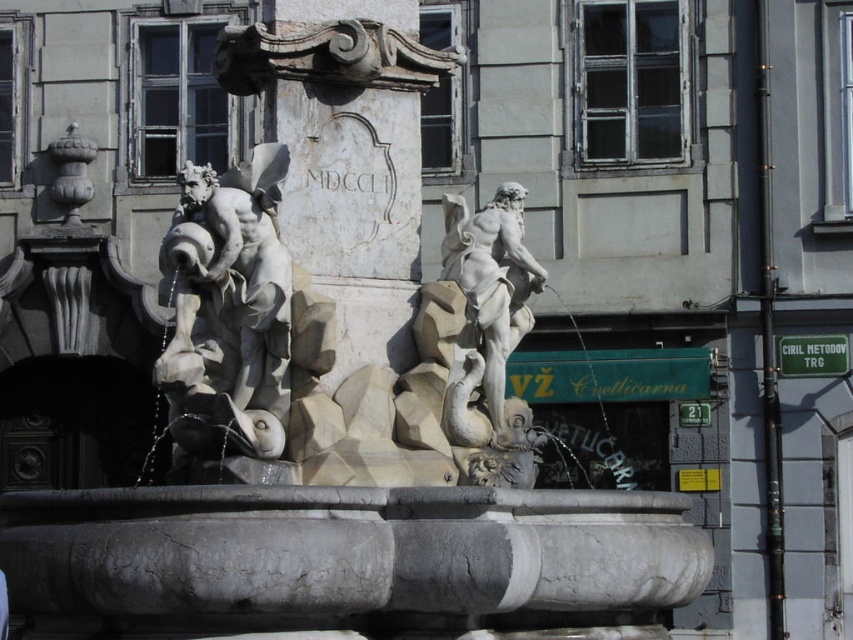
You are an art student visiting the fountain and want to sketch the statues. You notice two statues, the white marble statue at left and the white marble statue at center. Which one should you focus on first if you want to draw the taller one?

The white marble statue at left is much taller than the white marble statue at center, so you should focus on the white marble statue at left first.

You are a tour guide leading a group to the center statue. You are currently at the left statue. The path between them is straight. Your group has a child who uses a wheelchair. Is the path between the white marble statue at left and the white marble statue at center wide enough for the wheelchair to pass through comfortably?

The distance between the white marble statue at left and the white marble statue at center is 4.20 meters. A standard wheelchair requires a minimum of 0.9 meters of width to pass through comfortably. Since 4.20 meters is significantly wider than 0.9 meters, the path is more than wide enough for the wheelchair to pass through comfortably.

You are an art student trying to sketch the fountain. You need to ensure the proportions of the white marble statue at left and the white marble statue at center are accurate. Which statue should you draw first if you want to focus on the wider one?

You should draw the white marble statue at left first because its width is larger than the white marble statue at center.